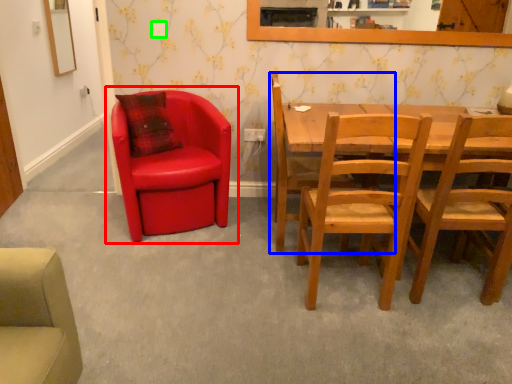
Question: Estimate the real-world distances between objects in this image. Which object is farther from chair (highlighted by a red box), chair (highlighted by a blue box) or power outlet (highlighted by a green box)?

Choices:
 (A) chair
 (B) power outlet

Answer: (B)